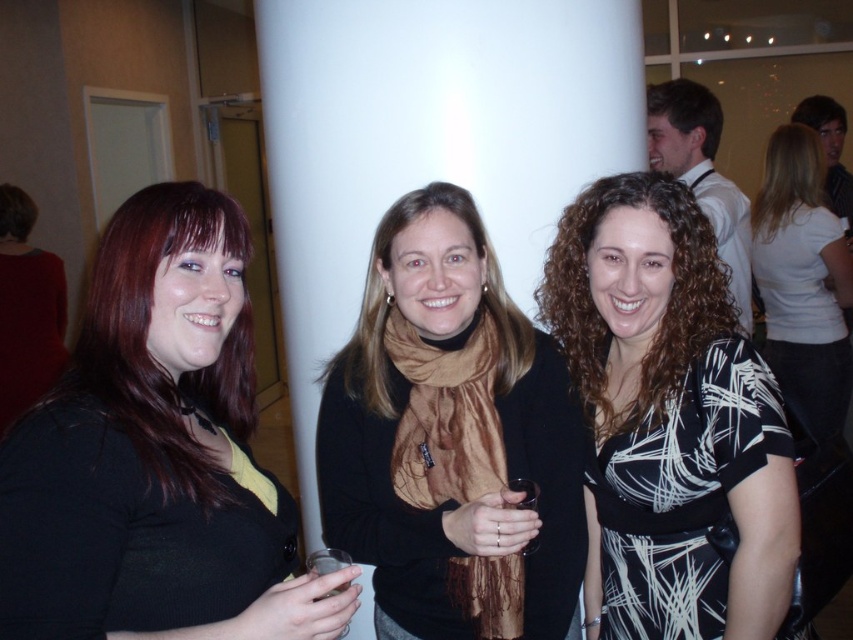
Does black and white dress at center have a smaller size compared to curly hair at center?

No, black and white dress at center is not smaller than curly hair at center.

Can you confirm if black and white dress at center is wider than curly hair at center?

Yes, black and white dress at center is wider than curly hair at center.

Does point (752, 460) come behind point (682, 275)?

No, it is in front of (682, 275).

I want to click on black and white dress at center, so click(669, 419).

Between point (450, 464) and point (699, 145), which one is positioned in front?

Positioned in front is point (450, 464).

Between brown silk scarf at center and brown hair at center, which one appears on the right side from the viewer's perspective?

brown hair at center is more to the right.

Locate an element on the screen. brown silk scarf at center is located at coordinates (451, 438).

Locate an element on the screen. This screenshot has width=853, height=640. matte black hair at left is located at coordinates (161, 353).

Is point (103, 365) in front of point (569, 244)?

Yes.

Is point (155, 209) behind point (692, 362)?

No.

Identify the location of matte black hair at left. This screenshot has height=640, width=853. (161, 353).